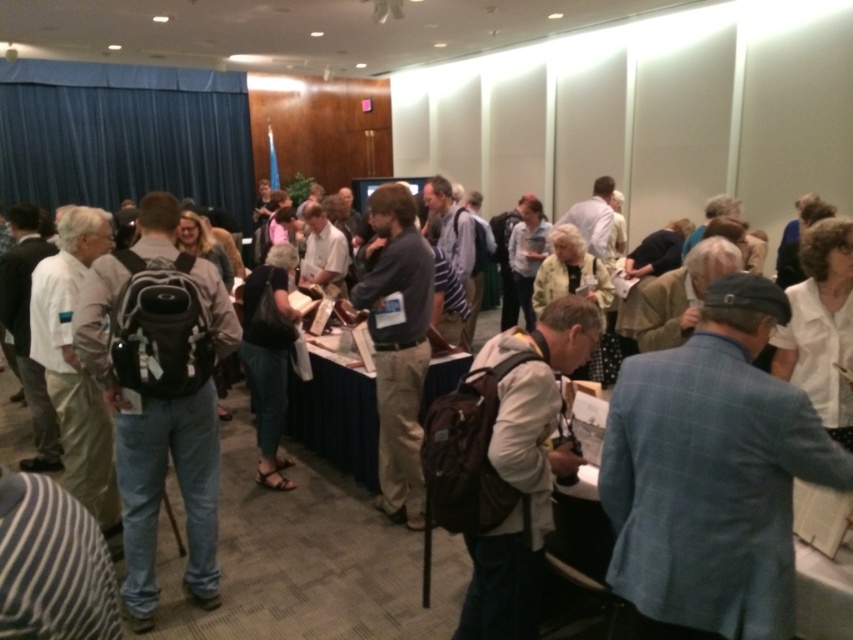
Which is behind, point (515, 522) or point (401, 276)?

Point (401, 276)

Is point (514, 625) positioned behind point (428, 268)?

No.

Does point (556, 390) lie behind point (370, 301)?

No, (556, 390) is closer to viewer.

In order to click on white cotton shirt at center in this screenshot , I will do `click(524, 467)`.

Who is shorter, matte black backpack at center or dark gray sweater at center?

With less height is dark gray sweater at center.

Between point (138, 422) and point (392, 449), which one is positioned behind?

Positioned behind is point (392, 449).

Where is `matte black backpack at center`? matte black backpack at center is located at coordinates (160, 438).

Based on the photo, between blue plaid blazer at center and dark gray sweater at center, which one is positioned higher?

Positioned higher is dark gray sweater at center.

Does blue plaid blazer at center appear on the left side of dark gray sweater at center?

No, blue plaid blazer at center is not to the left of dark gray sweater at center.

Does point (668, 596) lie in front of point (396, 465)?

Yes, point (668, 596) is closer to viewer.

You are a GUI agent. You are given a task and a screenshot of the screen. Output one action in this format:
    pyautogui.click(x=<x>, y=<y>)
    Task: Click on the blue plaid blazer at center
    
    Given the screenshot: What is the action you would take?
    pyautogui.click(x=711, y=476)